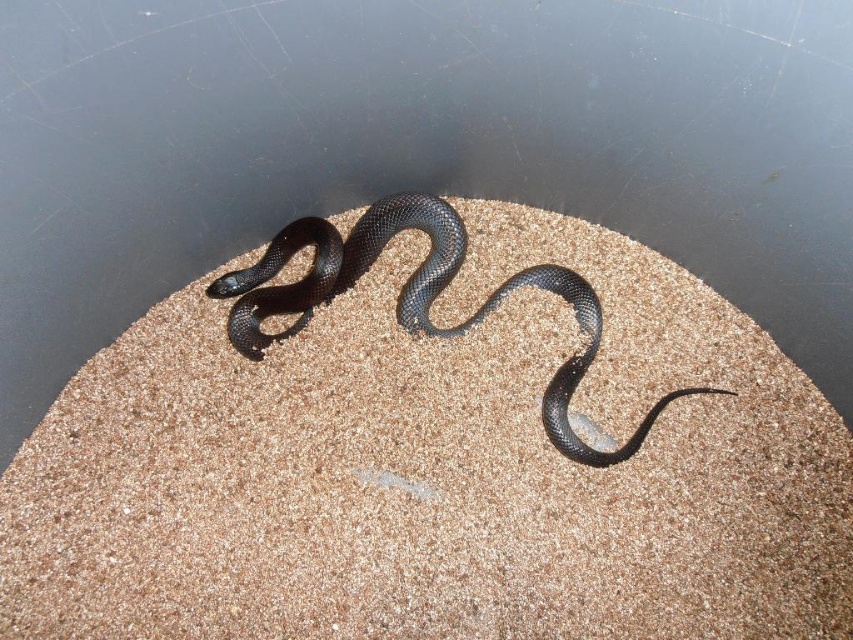
Who is more distant from viewer, (303, 394) or (419, 305)?

Point (419, 305)

Which is more to the right, brown textured sand at center or shiny black snake at center?

Positioned to the right is shiny black snake at center.

At what (x,y) coordinates should I click in order to perform the action: click on brown textured sand at center. Please return your answer as a coordinate pair (x, y). This screenshot has height=640, width=853. Looking at the image, I should click on (x=434, y=468).

Identify the location of brown textured sand at center. The height and width of the screenshot is (640, 853). (434, 468).